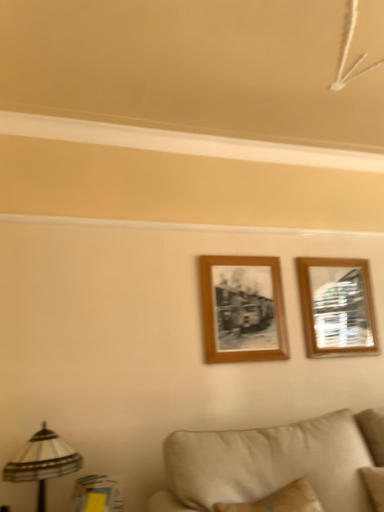
Question: From the image's perspective, is striped fabric lampshade at lower left above or below wooden photo frame at center, which is the second picture frame in right-to-left order?

Choices:
 (A) below
 (B) above

Answer: (A)

Question: From a real-world perspective, is striped fabric lampshade at lower left physically located above or below wooden photo frame at center, which is the second picture frame in right-to-left order?

Choices:
 (A) below
 (B) above

Answer: (A)

Question: Estimate the real-world distances between objects in this image. Which object is farther from the beige fabric couch at lower center?

Choices:
 (A) wooden photo frame at center, placed as the 1th picture frame when sorted from left to right
 (B) striped fabric lampshade at lower left
 (C) wooden picture frame at upper right, marked as the first picture frame in a right-to-left arrangement

Answer: (C)

Question: Considering the real-world distances, which object is closest to the wooden picture frame at upper right, marked as the first picture frame in a right-to-left arrangement?

Choices:
 (A) striped fabric lampshade at lower left
 (B) beige fabric couch at lower center
 (C) wooden photo frame at center, which is the second picture frame in right-to-left order

Answer: (C)